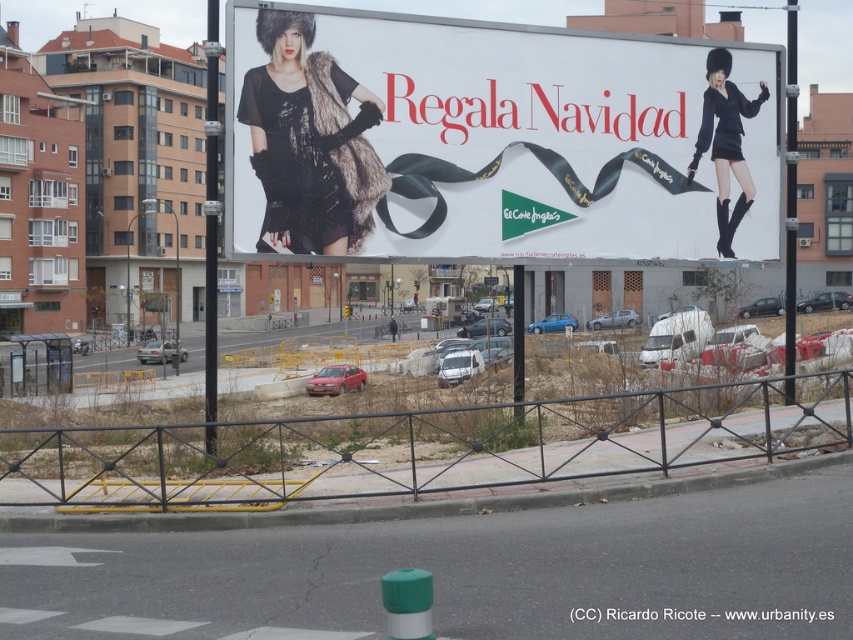
You are a photographer trying to capture the billboard advertisement for Regala Navidad. You notice the matte black dress at center and the black metal fence at lower center in your shot. Based on their sizes in the image, which object appears smaller?

The matte black dress at center appears smaller than the black metal fence at lower center because it has a lesser height compared to the black metal fence at lower center.

You are a photographer standing on the sidewalk. You want to take a photo of the billboard and ensure the black metal fence at lower center does not block the view. What is the minimum distance you should stand away from the fence to capture the entire billboard without obstruction?

The black metal fence at lower center is 14.36 meters away from the camera. To avoid obstruction, the photographer should stand at least 14.36 meters away from the fence to ensure the entire billboard is visible without the fence blocking the view.